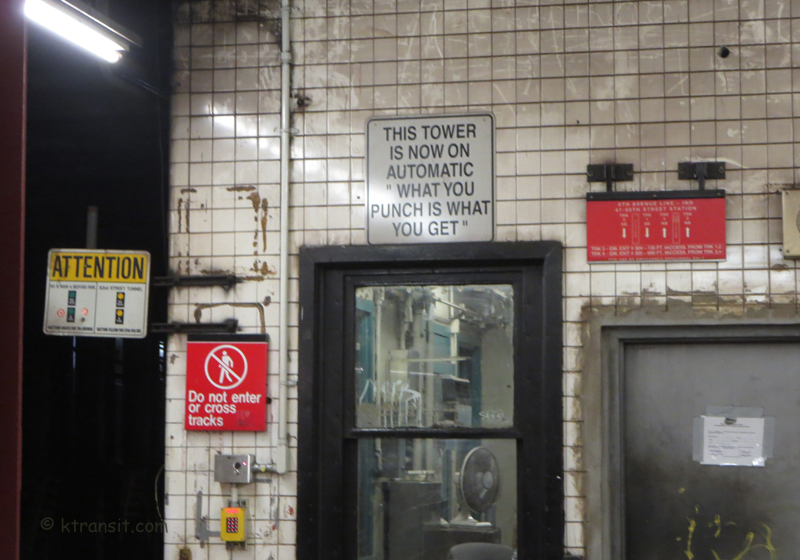
The height and width of the screenshot is (560, 800). Find the location of `door frame`. door frame is located at coordinates (656, 332).